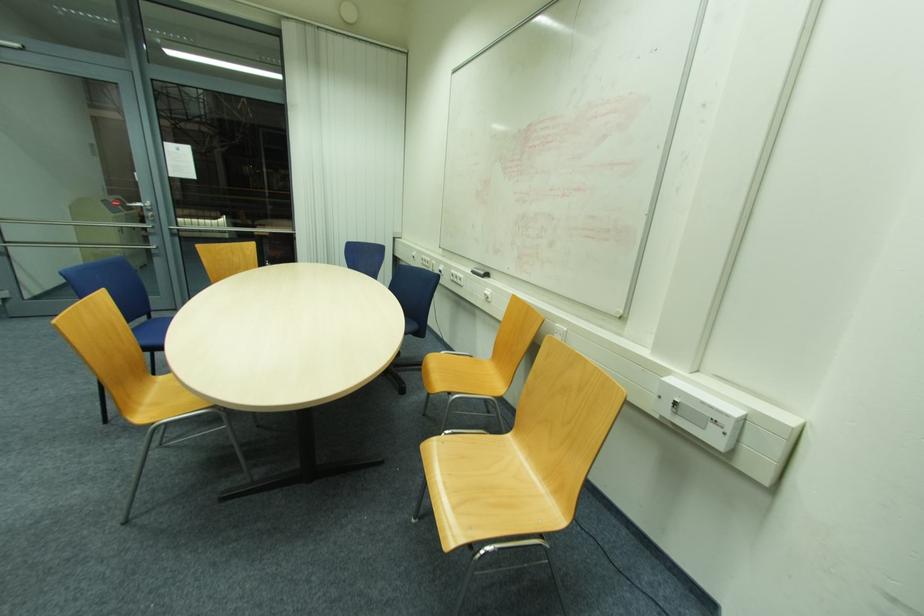
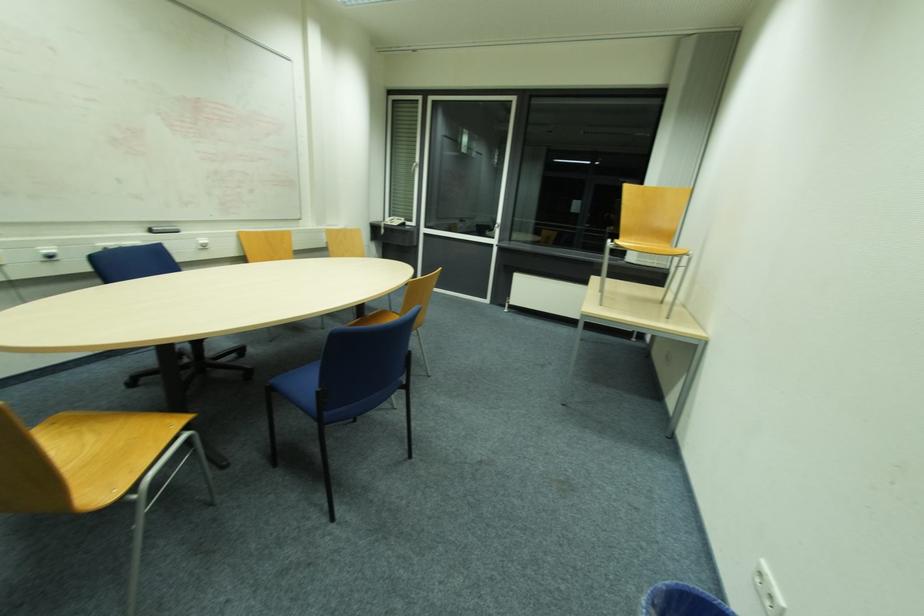
Find the pixel in the second image that matches (x=481, y=268) in the first image.

(151, 227)